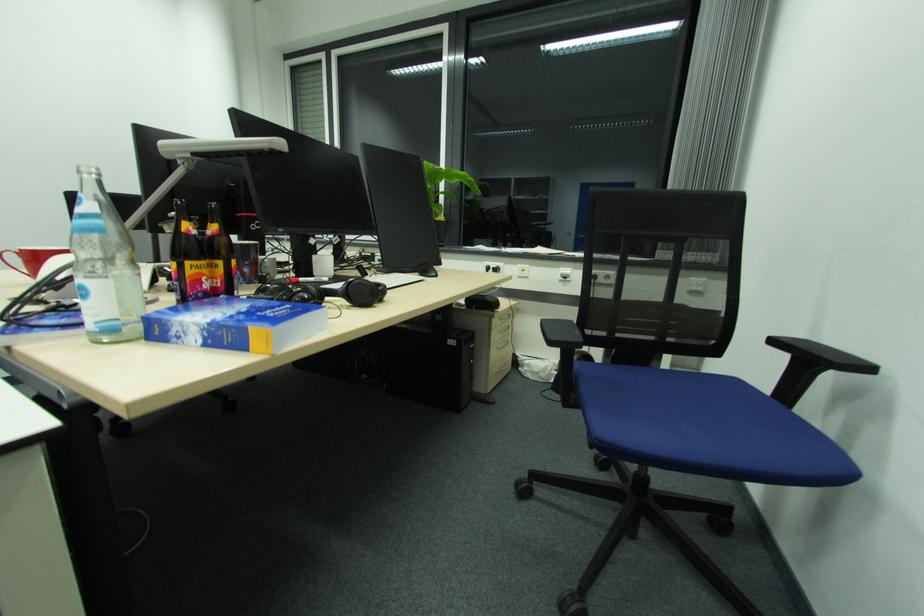
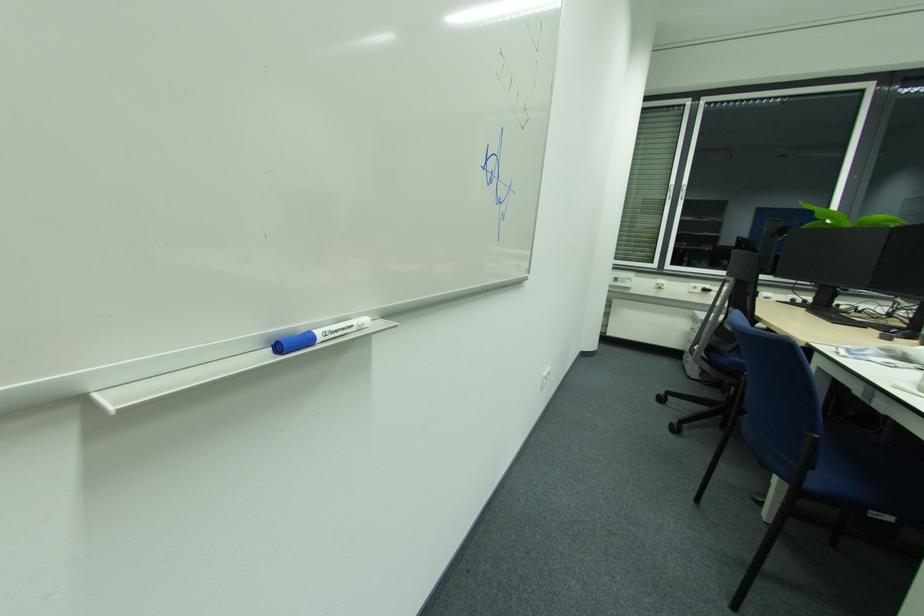
Question: Which direction would the cameraman need to move to produce the second image? Reply with the corresponding letter.

Choices:
 (A) Left
 (B) Right
 (C) Forward
 (D) Backward

Answer: (A)